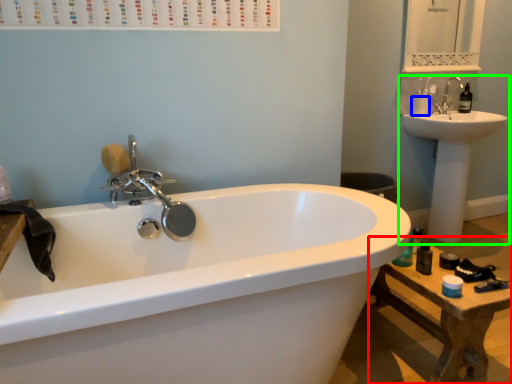
Question: Which object is the farthest from table (highlighted by a red box)? Choose among these: toilet paper (highlighted by a blue box) or sink (highlighted by a green box).

Choices:
 (A) toilet paper
 (B) sink

Answer: (A)